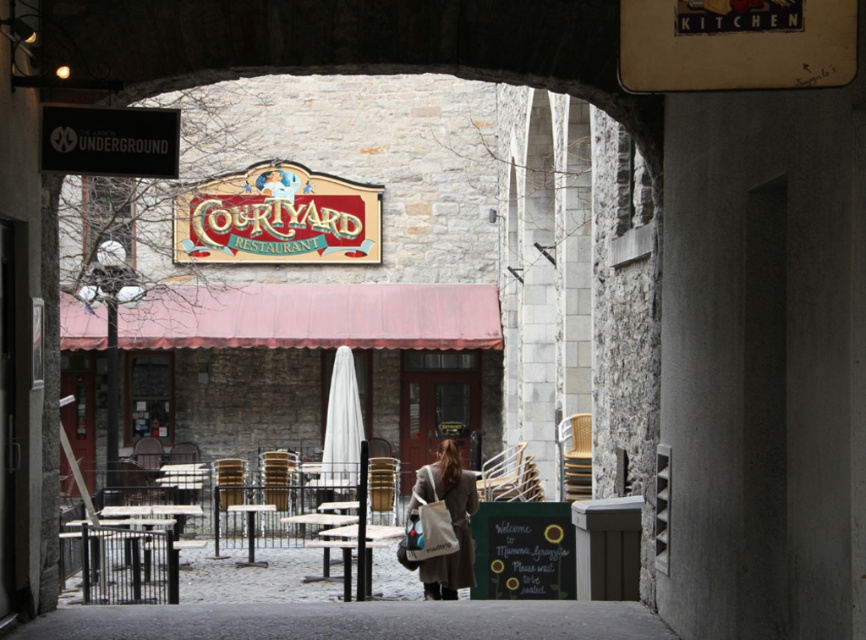
Question: Is the position of beige fabric bag at center less distant than that of white fabric umbrella at center?

Choices:
 (A) no
 (B) yes

Answer: (B)

Question: Which point is closer to the camera?

Choices:
 (A) metallic silver table at center
 (B) beige fabric bag at center

Answer: (B)

Question: Is black matte sign at upper left positioned before metallic silver table at center?

Choices:
 (A) yes
 (B) no

Answer: (A)

Question: Which point appears closest to the camera in this image?

Choices:
 (A) (260, 564)
 (B) (451, 570)
 (C) (366, 528)

Answer: (B)

Question: Does black matte sign at upper left have a lesser width compared to white fabric umbrella at center?

Choices:
 (A) yes
 (B) no

Answer: (B)

Question: Which object is farther from the camera taking this photo?

Choices:
 (A) white fabric umbrella at center
 (B) black matte sign at upper left

Answer: (A)